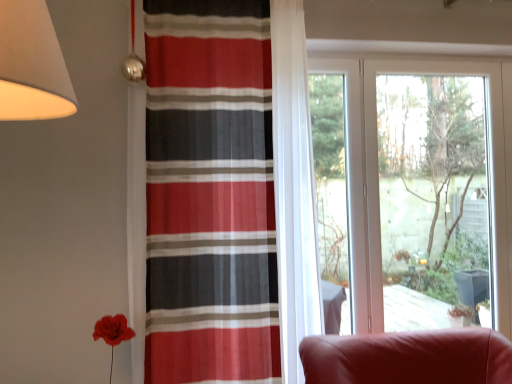
Question: From the image's perspective, is striped fabric curtain at center located above or below transparent glass window at center?

Choices:
 (A) above
 (B) below

Answer: (A)

Question: Is striped fabric curtain at center situated inside transparent glass window at center or outside?

Choices:
 (A) outside
 (B) inside

Answer: (A)

Question: Looking at the image, does striped fabric curtain at center seem bigger or smaller compared to transparent glass window at center?

Choices:
 (A) big
 (B) small

Answer: (A)

Question: Based on their positions, is transparent glass window at center located to the left or right of striped fabric curtain at center?

Choices:
 (A) left
 (B) right

Answer: (B)

Question: Is transparent glass window at center wider or thinner than striped fabric curtain at center?

Choices:
 (A) wide
 (B) thin

Answer: (B)

Question: Considering the positions of point (495, 155) and point (187, 266), is point (495, 155) closer or farther from the camera than point (187, 266)?

Choices:
 (A) farther
 (B) closer

Answer: (A)

Question: From a real-world perspective, is transparent glass window at center above or below striped fabric curtain at center?

Choices:
 (A) below
 (B) above

Answer: (A)